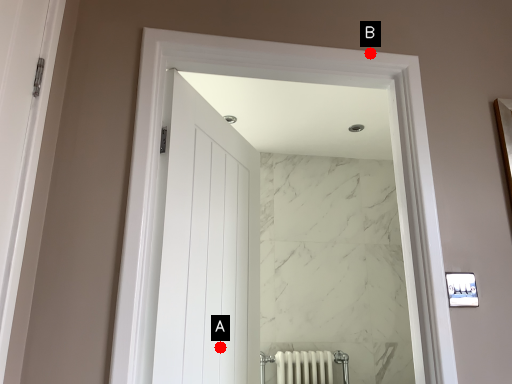
Question: Two points are circled on the image, labeled by A and B beside each circle. Which point is closer to the camera?

Choices:
 (A) A is closer
 (B) B is closer

Answer: (B)